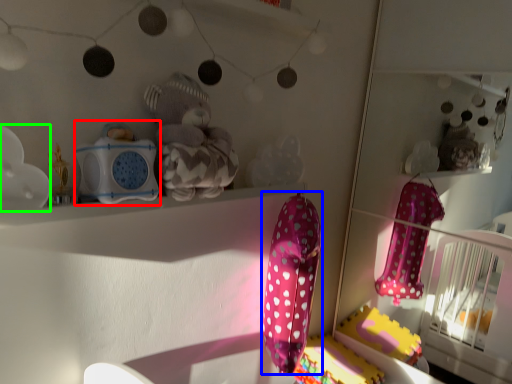
Question: Estimate the real-world distances between objects in this image. Which object is farther from toy (highlighted by a red box), baby clothe (highlighted by a blue box) or toy (highlighted by a green box)?

Choices:
 (A) baby clothe
 (B) toy

Answer: (A)